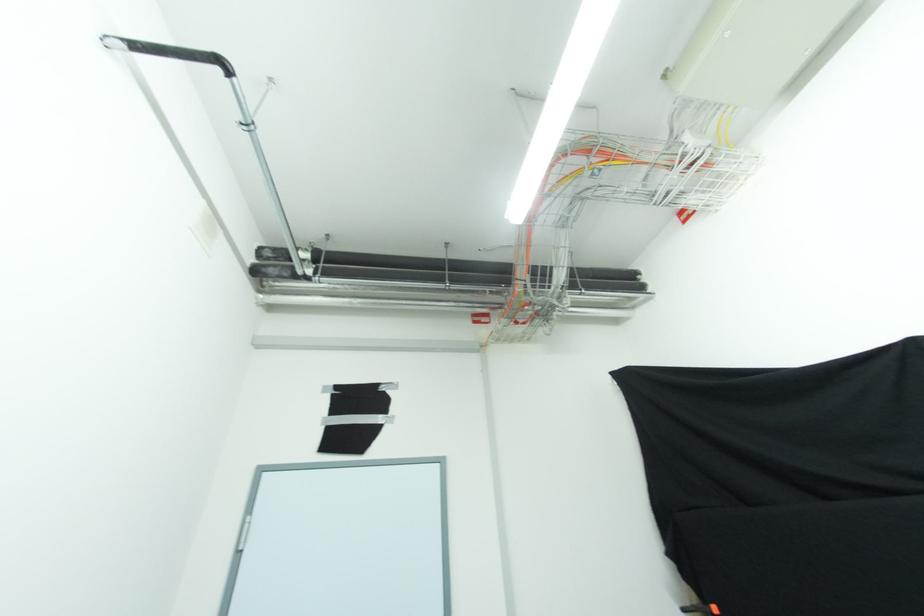
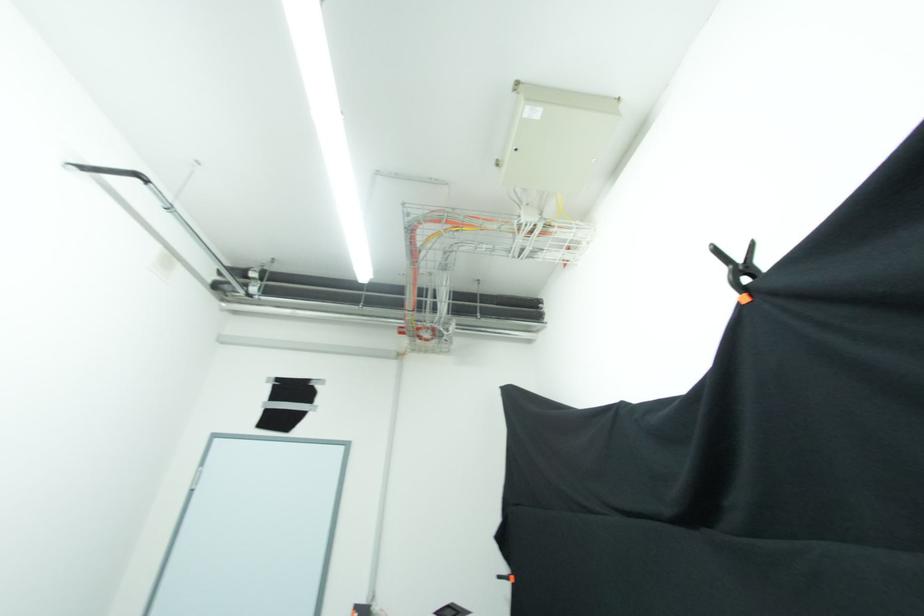
Question: The camera is either moving clockwise (left) or counter-clockwise (right) around the object. The first image is from the beginning of the video and the second image is from the end. Is the camera moving left or right when shooting the video?

Choices:
 (A) Left
 (B) Right

Answer: (B)